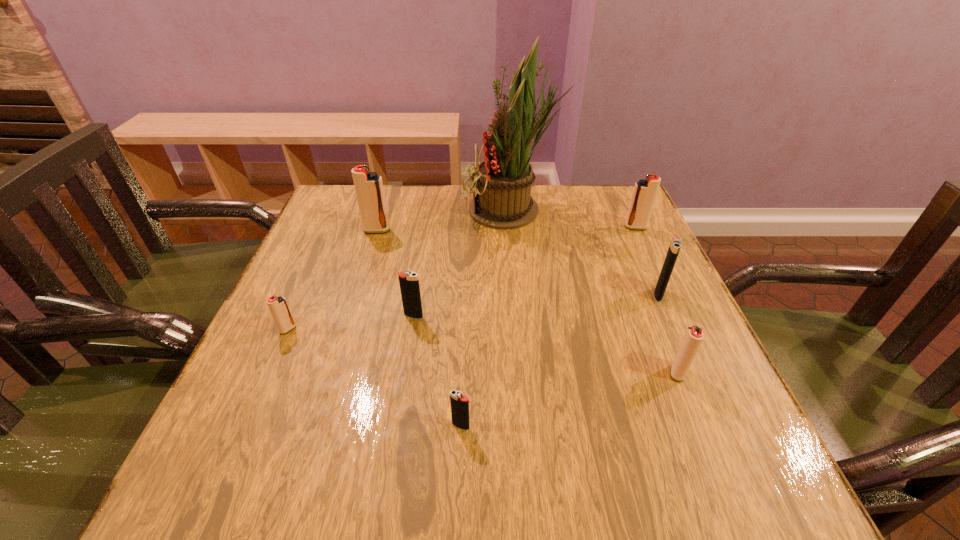
Find the location of `vacant space positioned 0.260m on the back of the fourth nearest object`. vacant space positioned 0.260m on the back of the fourth nearest object is located at coordinates (425, 239).

Image resolution: width=960 pixels, height=540 pixels. In order to click on free space located 0.140m on the front of the nearest red igniter in this screenshot , I will do `click(712, 458)`.

This screenshot has width=960, height=540. Identify the location of vacant position located 0.250m on the back of the leftmost object. (324, 248).

Image resolution: width=960 pixels, height=540 pixels. Identify the location of free space located 0.090m on the front of the smallest black igniter. (459, 487).

Identify the location of flower arrangement that is positioned at the far edge. The height and width of the screenshot is (540, 960). (504, 201).

Identify the location of object positioned at the far left corner. This screenshot has width=960, height=540. (369, 190).

At what (x,y) coordinates should I click in order to perform the action: click on object that is at the far right corner. Please return your answer as a coordinate pair (x, y). This screenshot has height=540, width=960. Looking at the image, I should click on (644, 194).

You are a GUI agent. You are given a task and a screenshot of the screen. Output one action in this format:
    pyautogui.click(x=<x>, y=<y>)
    Task: Click on the free location at the far edge
    The width and height of the screenshot is (960, 540).
    Given the screenshot: What is the action you would take?
    coord(513,232)

In the image, there is a desktop. At what (x,y) coordinates should I click in order to perform the action: click on vacant space at the near edge. Please return your answer as a coordinate pair (x, y). Looking at the image, I should click on (503, 456).

The height and width of the screenshot is (540, 960). I want to click on free space at the left edge of the desktop, so click(357, 281).